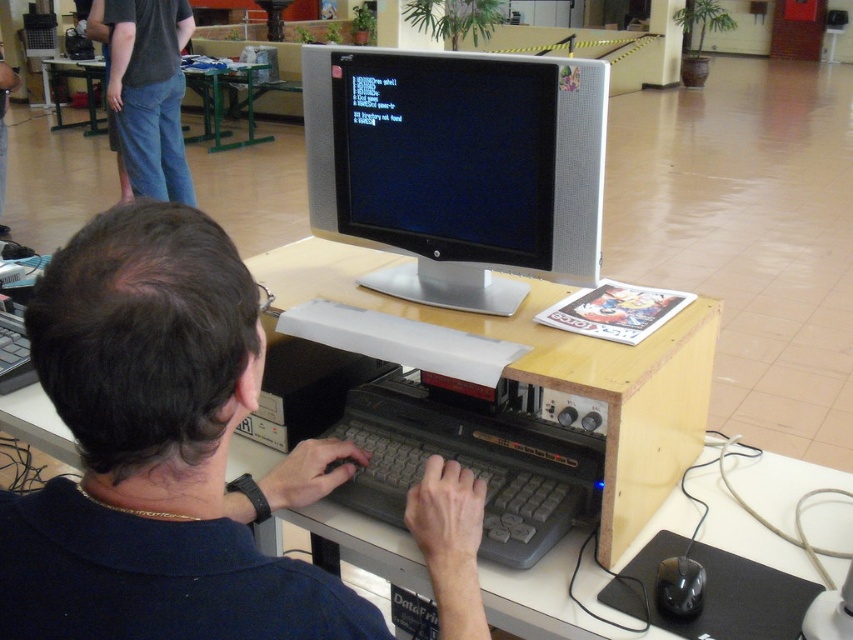
You are a technician trying to troubleshoot the computer. You need to check if the silver metallic monitor at center is compatible with the black plastic mouse at lower right. What should you consider about their sizes?

The silver metallic monitor at center is much taller than the black plastic mouse at lower right, so their sizes are not directly related to compatibility. Compatibility depends on other factors like connection types or software support.

You are setting up a new desk layout and want to place both the silver metallic monitor at center and the black plastic mouse at lower right. Given that the desk space is limited, which object should you prioritize placing first to ensure it fits properly?

You should prioritize placing the silver metallic monitor at center first because its width is larger than the black plastic mouse at lower right, so it requires more space and should be positioned before the smaller mouse to optimize desk layout.